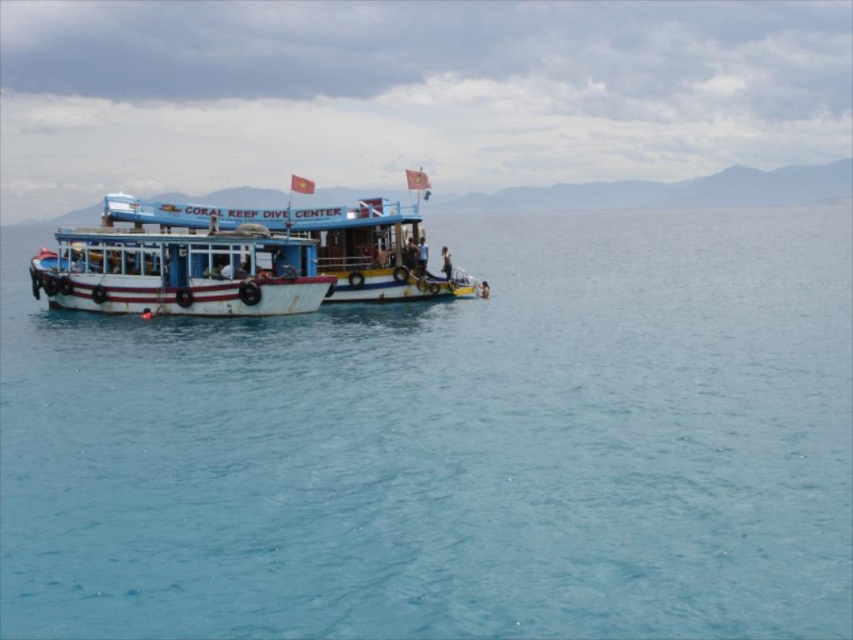
Question: Which object appears farthest from the camera in this image?

Choices:
 (A) white matte boat at center
 (B) blue water at center

Answer: (A)

Question: Among these points, which one is farthest from the camera?

Choices:
 (A) (809, 486)
 (B) (469, 280)

Answer: (B)

Question: Where is blue water at center located in relation to white matte boat at center in the image?

Choices:
 (A) left
 (B) right

Answer: (B)

Question: Which of the following is the closest to the observer?

Choices:
 (A) white matte boat at center
 (B) blue water at center

Answer: (B)

Question: Is blue water at center to the right of white matte boat at center from the viewer's perspective?

Choices:
 (A) yes
 (B) no

Answer: (A)

Question: Is blue water at center bigger than white matte boat at center?

Choices:
 (A) no
 (B) yes

Answer: (B)